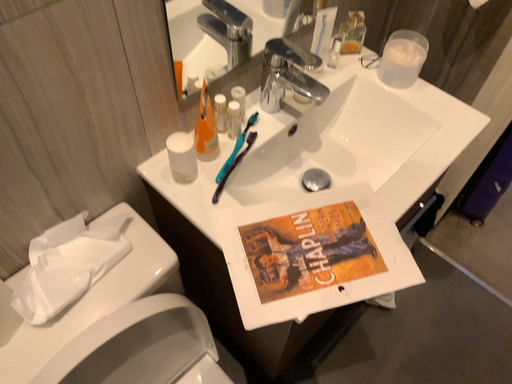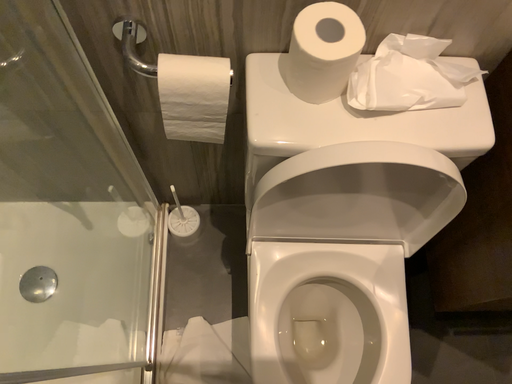
Question: Which way did the camera rotate in the video?

Choices:
 (A) rotated left
 (B) rotated right

Answer: (A)